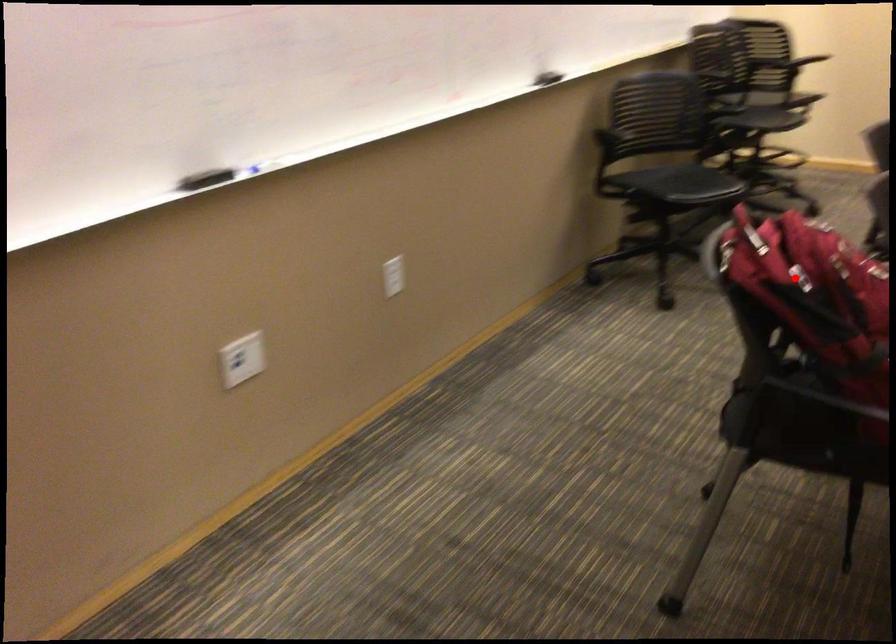
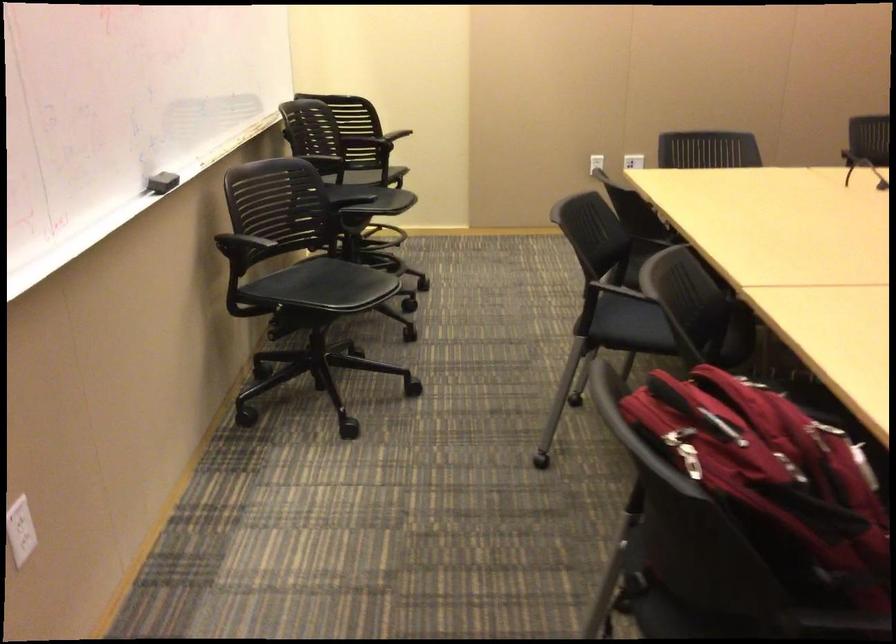
Question: I am providing you with two images of the same scene from different viewpoints. A red point is marked on the first image. At the location where the point appears in image 1, is it still visible in image 2?

Choices:
 (A) Yes
 (B) No

Answer: (A)